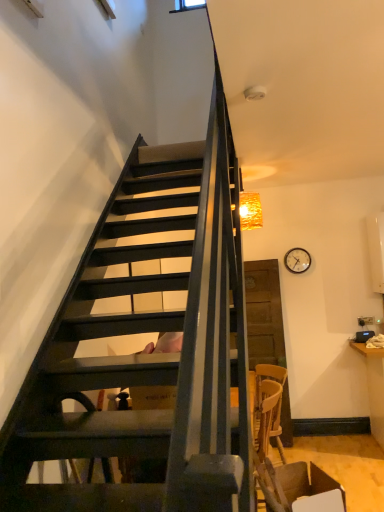
Where is `crinkled gold lampshade at upper right`? This screenshot has height=512, width=384. crinkled gold lampshade at upper right is located at coordinates (250, 211).

What do you see at coordinates (250, 211) in the screenshot? The height and width of the screenshot is (512, 384). I see `crinkled gold lampshade at upper right` at bounding box center [250, 211].

At what (x,y) coordinates should I click in order to perform the action: click on crinkled gold lampshade at upper right. Please return your answer as a coordinate pair (x, y). The height and width of the screenshot is (512, 384). Looking at the image, I should click on (250, 211).

From the image's perspective, relative to wooden clock at upper right, is crinkled gold lampshade at upper right above or below?

Based on their image positions, crinkled gold lampshade at upper right is located above wooden clock at upper right.

Is crinkled gold lampshade at upper right far from wooden clock at upper right?

No, there isn't a large distance between crinkled gold lampshade at upper right and wooden clock at upper right.

From a real-world perspective, is crinkled gold lampshade at upper right located beneath wooden clock at upper right?

No.

Can you confirm if wooden clock at upper right is positioned to the left of crinkled gold lampshade at upper right?

No.

Which of these two, wooden clock at upper right or crinkled gold lampshade at upper right, is wider?

With larger width is crinkled gold lampshade at upper right.

From a real-world perspective, relative to crinkled gold lampshade at upper right, is wooden clock at upper right vertically above or below?

wooden clock at upper right is situated lower than crinkled gold lampshade at upper right in the real world.

Between wooden clock at upper right and crinkled gold lampshade at upper right, which one has more height?

Standing taller between the two is crinkled gold lampshade at upper right.

From the image's perspective, relative to brown leather armchair at lower right, is crinkled gold lampshade at upper right above or below?

Based on their image positions, crinkled gold lampshade at upper right is located above brown leather armchair at lower right.

In the scene shown: Which is more to the right, crinkled gold lampshade at upper right or brown leather armchair at lower right?

Positioned to the right is brown leather armchair at lower right.

Who is bigger, crinkled gold lampshade at upper right or brown leather armchair at lower right?

brown leather armchair at lower right is bigger.

Is brown leather armchair at lower right looking in the opposite direction of crinkled gold lampshade at upper right?

No, crinkled gold lampshade at upper right is not at the back of brown leather armchair at lower right.

Does point (276, 471) appear closer or farther from the camera than point (262, 223)?

Point (276, 471) appears to be closer to the viewer than point (262, 223).

In the image, there is a crinkled gold lampshade at upper right. Where is `armchair below it (from a real-world perspective)`? Image resolution: width=384 pixels, height=512 pixels. armchair below it (from a real-world perspective) is located at coordinates (299, 488).

Which object is closer to the camera taking this photo, brown leather armchair at lower right or crinkled gold lampshade at upper right?

Positioned in front is brown leather armchair at lower right.

How different are the orientations of wooden clock at upper right and brown leather armchair at lower right in degrees?

The angular difference between wooden clock at upper right and brown leather armchair at lower right is 111 degrees.

Which of these two, wooden clock at upper right or brown leather armchair at lower right, is smaller?

With smaller size is wooden clock at upper right.

In order to click on armchair located underneath the wooden clock at upper right (from a real-world perspective) in this screenshot , I will do `click(299, 488)`.

Who is taller, wooden clock at upper right or brown leather armchair at lower right?

With more height is brown leather armchair at lower right.

Is point (269, 501) closer to viewer compared to point (297, 254)?

Yes, it is.

Between brown leather armchair at lower right and wooden clock at upper right, which one has larger width?

With larger width is brown leather armchair at lower right.

In the image, is brown leather armchair at lower right positioned in front of or behind wooden clock at upper right?

Clearly, brown leather armchair at lower right is in front of wooden clock at upper right.

From a real-world perspective, which is physically below, brown leather armchair at lower right or wooden clock at upper right?

brown leather armchair at lower right.

Where is `clock lying on the right of crinkled gold lampshade at upper right`? Image resolution: width=384 pixels, height=512 pixels. clock lying on the right of crinkled gold lampshade at upper right is located at coordinates (297, 260).

I want to click on clock that appears below the crinkled gold lampshade at upper right (from the image's perspective), so click(297, 260).

Based on their spatial positions, is brown leather armchair at lower right or crinkled gold lampshade at upper right further from wooden clock at upper right?

The object further to wooden clock at upper right is brown leather armchair at lower right.

Considering their positions, is wooden clock at upper right positioned further to brown leather armchair at lower right than crinkled gold lampshade at upper right?

wooden clock at upper right.

Considering their positions, is wooden clock at upper right positioned closer to crinkled gold lampshade at upper right than brown leather armchair at lower right?

The object closer to crinkled gold lampshade at upper right is wooden clock at upper right.

Looking at the image, which one is located further to brown leather armchair at lower right, crinkled gold lampshade at upper right or wooden clock at upper right?

Among the two, wooden clock at upper right is located further to brown leather armchair at lower right.

Estimate the real-world distances between objects in this image. Which object is further from wooden clock at upper right, crinkled gold lampshade at upper right or brown leather armchair at lower right?

brown leather armchair at lower right lies further to wooden clock at upper right than the other object.

Estimate the real-world distances between objects in this image. Which object is further from crinkled gold lampshade at upper right, brown leather armchair at lower right or wooden clock at upper right?

brown leather armchair at lower right.

Locate an element on the screen. The height and width of the screenshot is (512, 384). lamp between brown leather armchair at lower right and wooden clock at upper right in the front-back direction is located at coordinates (250, 211).